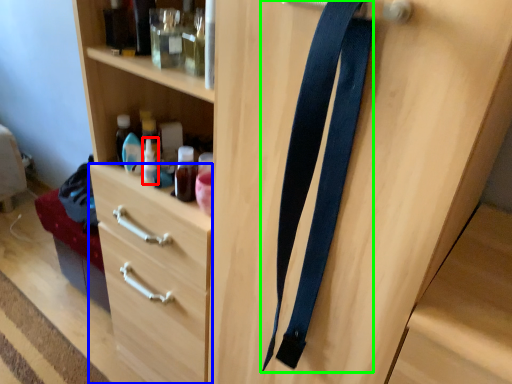
Question: Which is farther away from bottle (highlighted by a red box)? drawer (highlighted by a blue box) or suspenders (highlighted by a green box)?

Choices:
 (A) drawer
 (B) suspenders

Answer: (B)